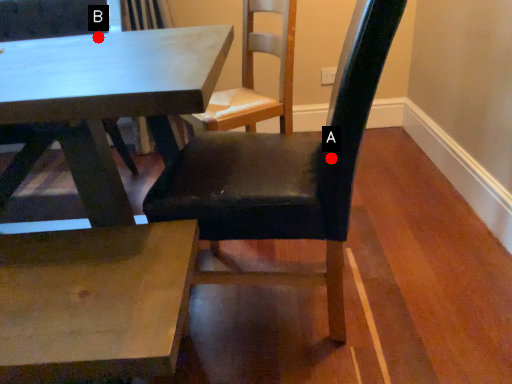
Question: Two points are circled on the image, labeled by A and B beside each circle. Which point is farther from the camera taking this photo?

Choices:
 (A) A is further
 (B) B is further

Answer: (B)